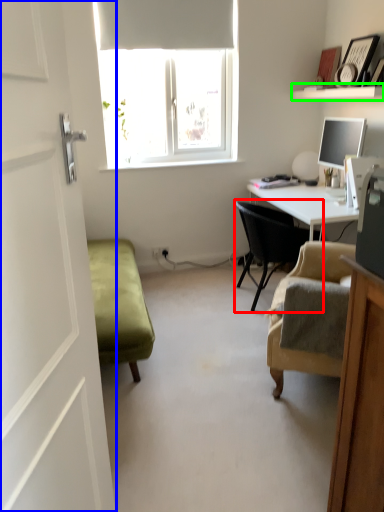
Question: Which object is positioned farthest from chair (highlighted by a red box)? Select from screen door (highlighted by a blue box) and shelf (highlighted by a green box).

Choices:
 (A) screen door
 (B) shelf

Answer: (A)